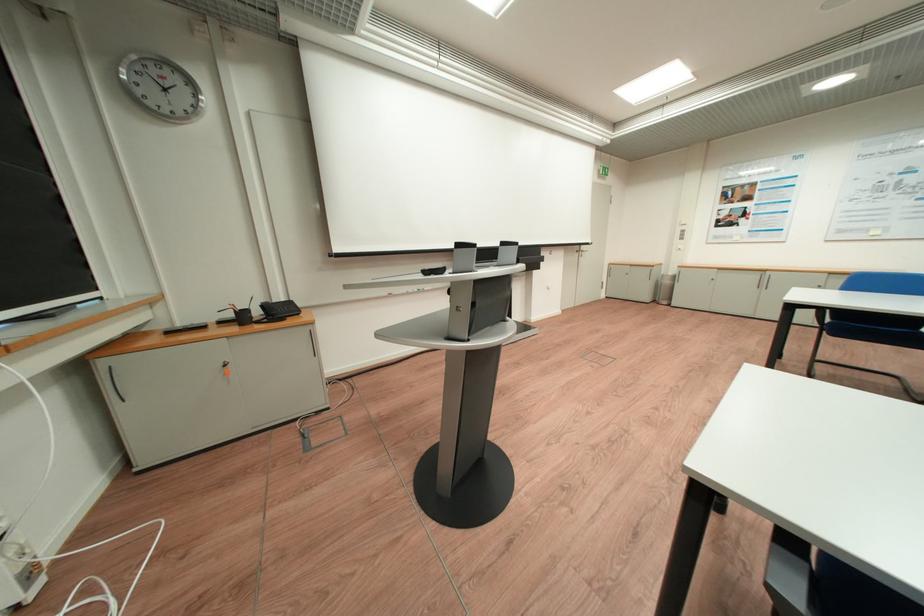
Identify the location of orange key. (225, 370).